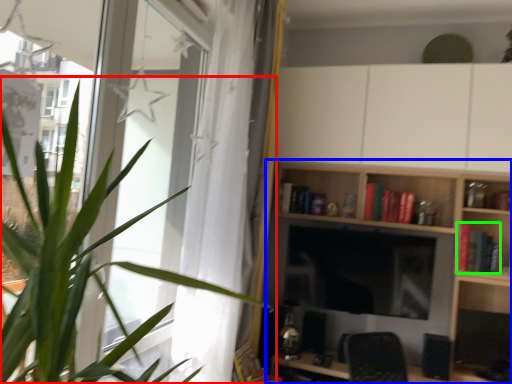
Question: Based on their relative distances, which object is farther from houseplant (highlighted by a red box)? Choose from shelf (highlighted by a blue box) and book (highlighted by a green box).

Choices:
 (A) shelf
 (B) book

Answer: (B)